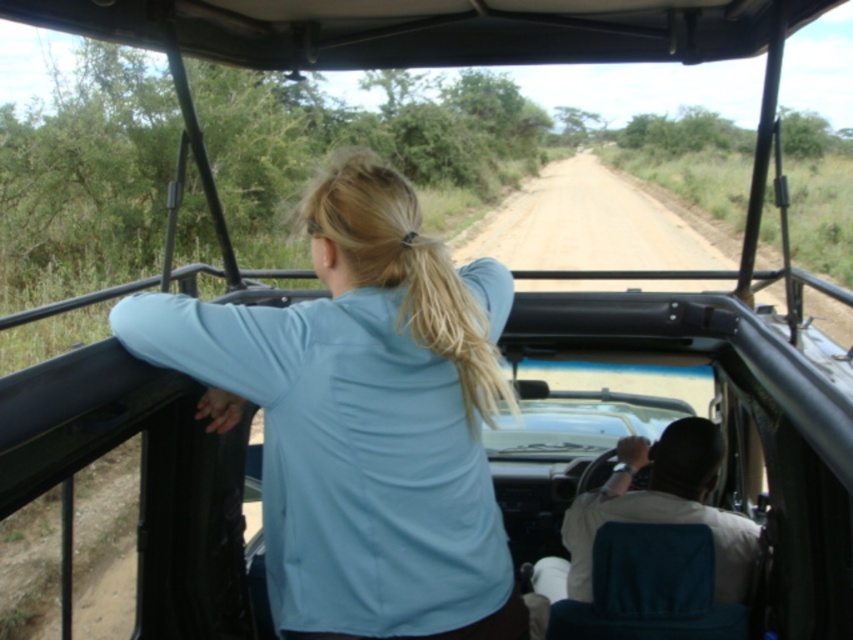
You are a passenger in the safari vehicle and want to check if the light blue fabric at center is covering the white cotton shirt at center. Can you confirm this?

The light blue fabric at center is positioned over white cotton shirt at center, so yes, the light blue fabric at center is covering the white cotton shirt at center.

You are a passenger in the safari vehicle and want to know which item is closer to the left side of the vehicle. Which one is it between the light blue fabric at center and the white cotton shirt at center?

The light blue fabric at center is closer to the left side of the vehicle because it is positioned to the left of the white cotton shirt at center.